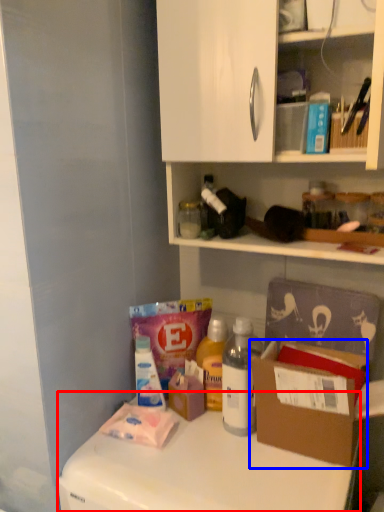
Question: Which object is closer to the camera taking this photo, counter top (highlighted by a red box) or cardboard box (highlighted by a blue box)?

Choices:
 (A) counter top
 (B) cardboard box

Answer: (A)